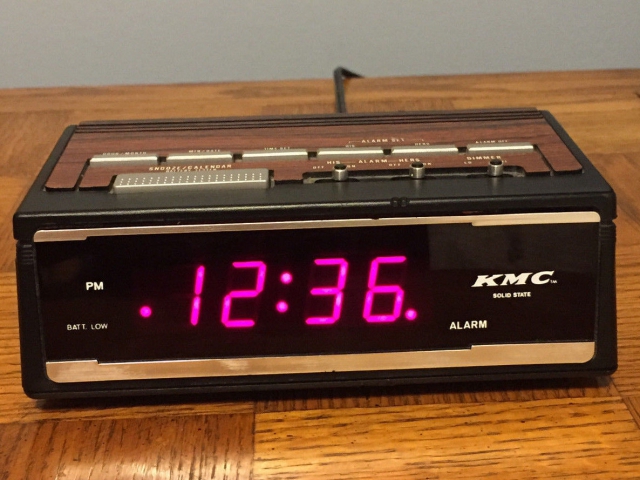
Locate an element on the screen. electric cord is located at coordinates (337, 91).